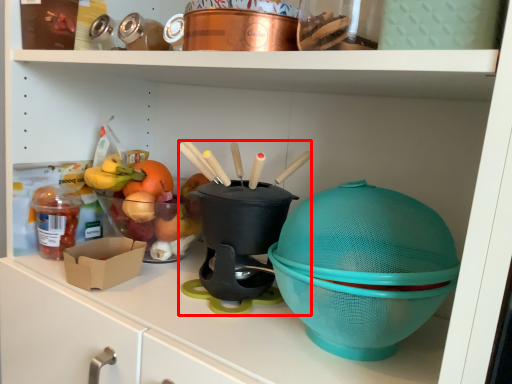
Question: From the image, what is the correct spatial relationship of appliance (annotated by the red box) in relation to food?

Choices:
 (A) right
 (B) left

Answer: (A)